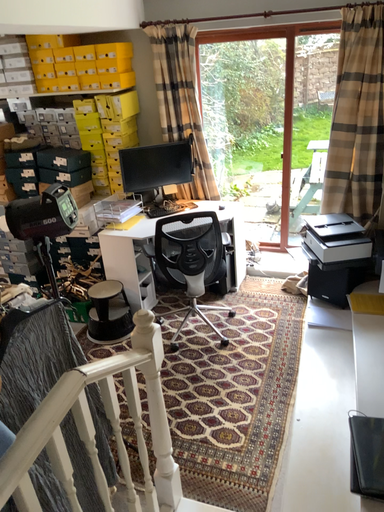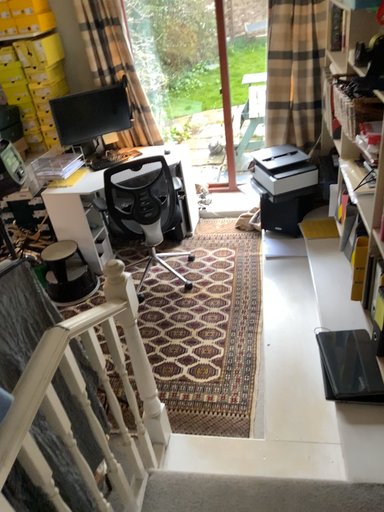
Question: Which way did the camera rotate in the video?

Choices:
 (A) rotated left
 (B) rotated right

Answer: (B)